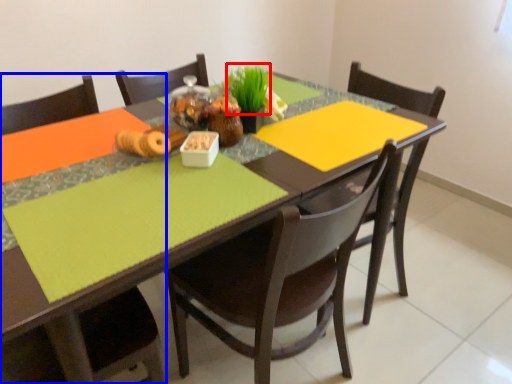
Question: Which point is closer to the camera, grass (highlighted by a red box) or chair (highlighted by a blue box)?

Choices:
 (A) grass
 (B) chair

Answer: (B)